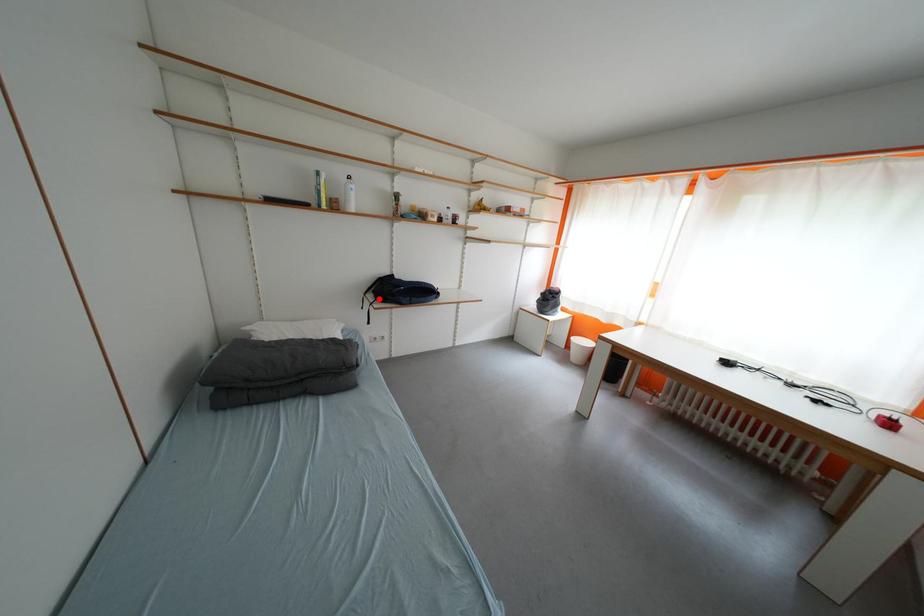
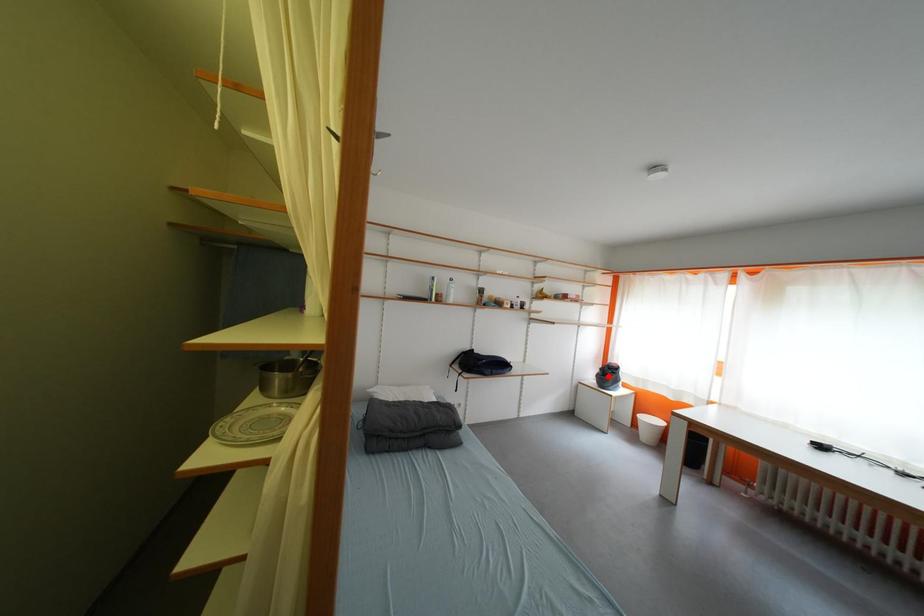
I am providing you with two images of the same scene from different viewpoints. A red point is marked on the first image and another point is marked on the second image. Are the points marked in image1 and image2 representing the same 3D position?

No